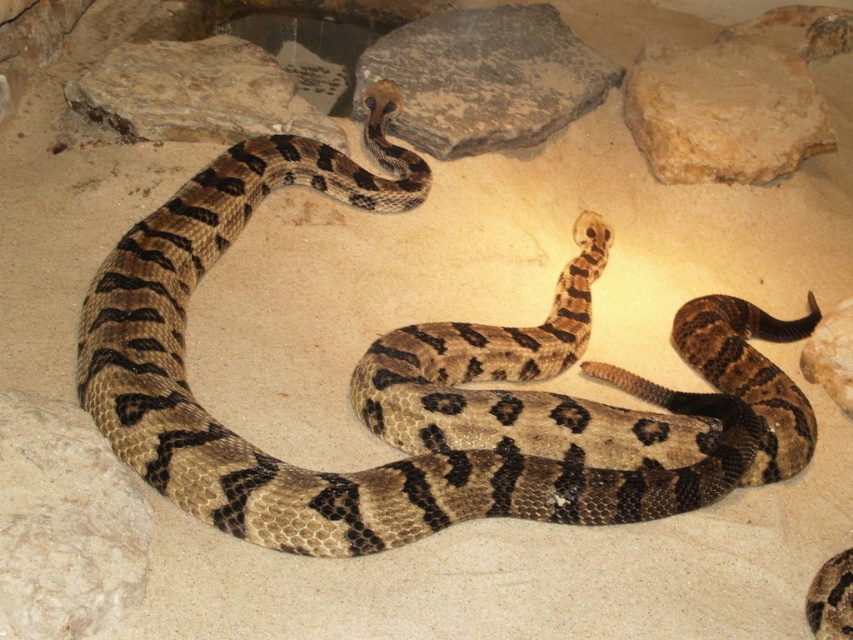
Question: Among these points, which one is farthest from the camera?

Choices:
 (A) (689, 141)
 (B) (848, 381)
 (C) (294, 109)
 (D) (86, 616)

Answer: (A)

Question: Observing the image, what is the correct spatial positioning of brown scaly snake at center in reference to smooth beige rock at upper right?

Choices:
 (A) below
 (B) above

Answer: (A)

Question: Which object is positioned closest to the brown rough rock at upper center?

Choices:
 (A) smooth beige rock at upper right
 (B) brown scaly snake at center
 (C) smooth rock at lower right

Answer: (B)

Question: Which of these objects is positioned closest to the brown rough rock at upper center?

Choices:
 (A) brown scaly snake at center
 (B) gray rock at upper center
 (C) beige rough rock at lower left

Answer: (B)

Question: Can you confirm if brown scaly snake at center is wider than brown rough rock at upper center?

Choices:
 (A) no
 (B) yes

Answer: (B)

Question: Considering the relative positions of brown rough rock at upper center and smooth rock at lower right in the image provided, where is brown rough rock at upper center located with respect to smooth rock at lower right?

Choices:
 (A) left
 (B) right

Answer: (A)